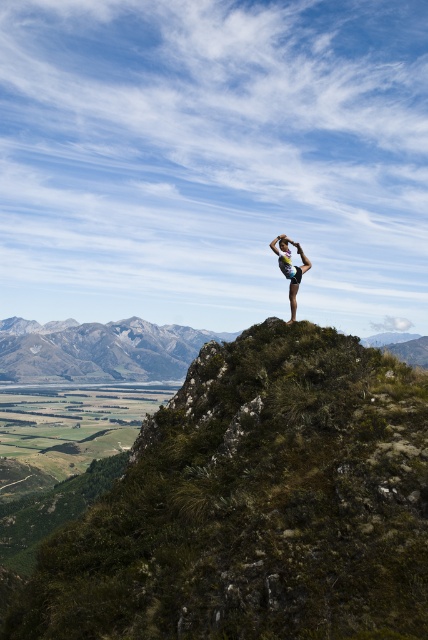
Based on the scene description, where is the green grassy mountain at center located in the image?

The green grassy mountain at center is located at point (98, 348).

You are a photographer planning to take a photo of the matte skin person at center and the green grassy mountain at center. Based on their positions, which object is closer to the camera?

The matte skin person at center is closer to the camera than the green grassy mountain at center because the green grassy mountain at center is located below the matte skin person at center, indicating depth where the person is in front.